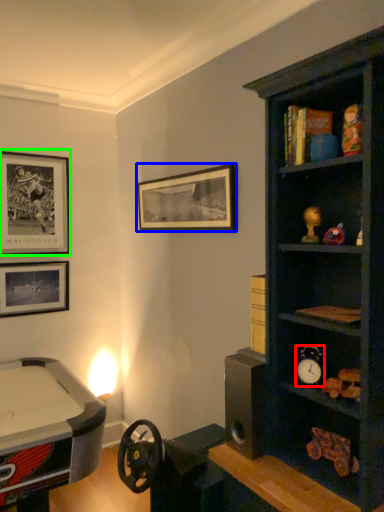
Question: Estimate the real-world distances between objects in this image. Which object is farther from clock (highlighted by a red box), picture frame (highlighted by a blue box) or picture frame (highlighted by a green box)?

Choices:
 (A) picture frame
 (B) picture frame

Answer: (B)